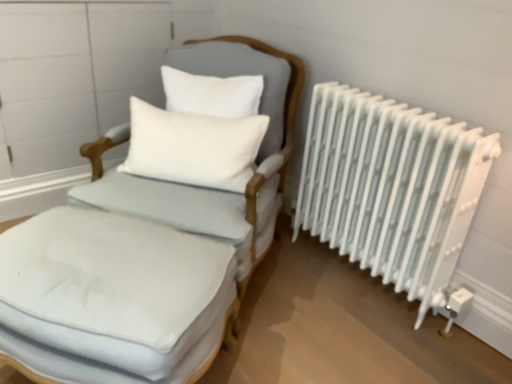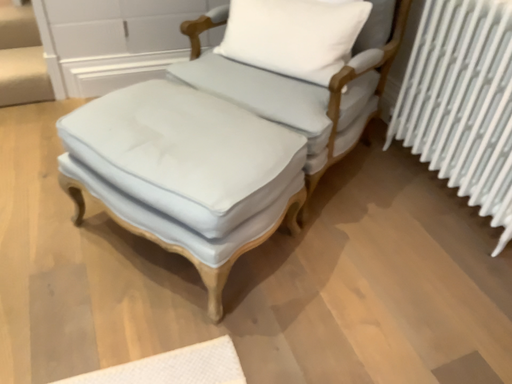
Question: How did the camera likely rotate when shooting the video?

Choices:
 (A) rotated upward
 (B) rotated downward

Answer: (B)